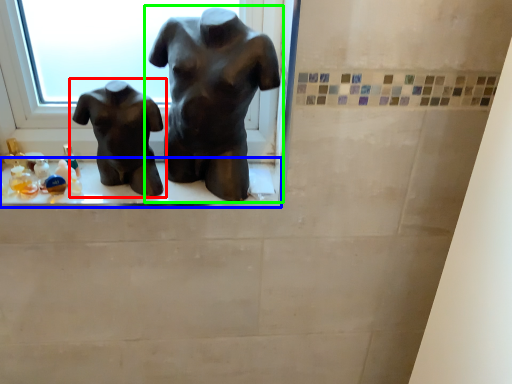
Question: Which object is positioned closest to statue (sculpture) (highlighted by a red box)? Select from window sill (highlighted by a blue box) and statue (sculpture) (highlighted by a green box).

Choices:
 (A) window sill
 (B) statue (sculpture)

Answer: (A)